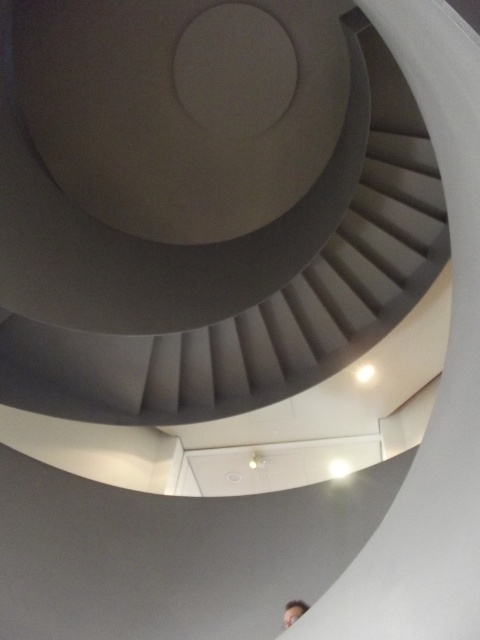
The image size is (480, 640). What are the coordinates of `smooth gray stairs at center` in the screenshot? It's located at (x=200, y=209).

Identify the location of smooth gray stairs at center. The height and width of the screenshot is (640, 480). (200, 209).